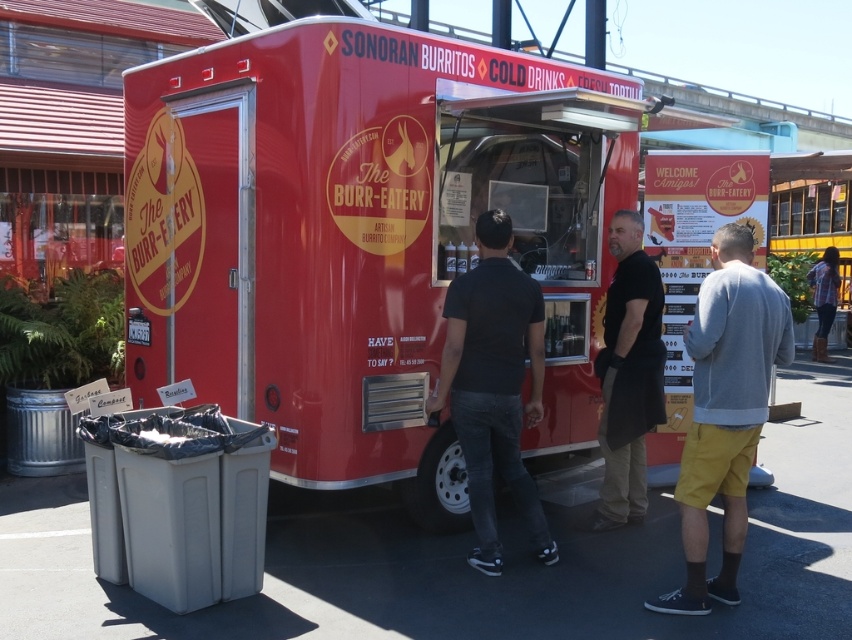
Locate an element on the screen. This screenshot has height=640, width=852. matte red food truck at center is located at coordinates (355, 241).

Where is `matte red food truck at center`? Image resolution: width=852 pixels, height=640 pixels. matte red food truck at center is located at coordinates (355, 241).

In order to click on matte red food truck at center in this screenshot , I will do `click(355, 241)`.

Between gray cotton sweatshirt at center and plaid shirt at upper right, which one has less height?

plaid shirt at upper right

Does gray cotton sweatshirt at center have a smaller size compared to plaid shirt at upper right?

Indeed, gray cotton sweatshirt at center has a smaller size compared to plaid shirt at upper right.

Who is more forward, (712, 285) or (821, 332)?

Point (712, 285) is more forward.

Locate an element on the screen. gray cotton sweatshirt at center is located at coordinates (724, 410).

Is matte red food truck at center closer to camera compared to black matte apron at center?

Yes, matte red food truck at center is closer to the viewer.

Is point (170, 161) positioned in front of point (648, 296)?

No, it is behind (648, 296).

Does point (251, 275) come in front of point (625, 369)?

Yes, it is.

Image resolution: width=852 pixels, height=640 pixels. Identify the location of matte red food truck at center. (355, 241).